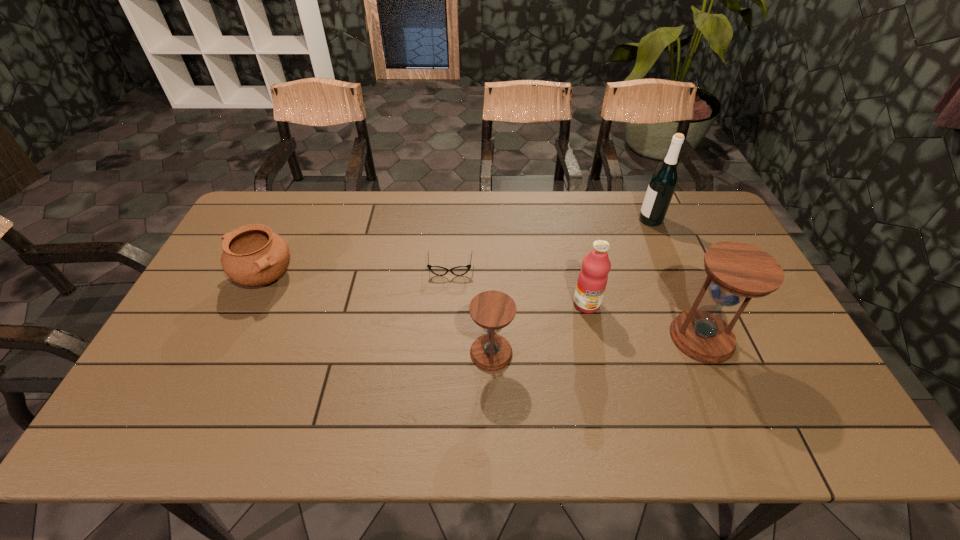
Where is `free space located 0.400m on the back of the left hourglass`? This screenshot has height=540, width=960. free space located 0.400m on the back of the left hourglass is located at coordinates (489, 238).

Image resolution: width=960 pixels, height=540 pixels. I want to click on free space located 0.050m on the back of the right hourglass, so click(685, 300).

You are a GUI agent. You are given a task and a screenshot of the screen. Output one action in this format:
    pyautogui.click(x=<x>, y=<y>)
    Task: Click on the free space located 0.080m on the label of the wine bottle
    The height and width of the screenshot is (540, 960).
    Given the screenshot: What is the action you would take?
    pyautogui.click(x=615, y=220)

Find the location of a particular element. Image resolution: width=960 pixels, height=540 pixels. free space located on the label of the wine bottle is located at coordinates (540, 220).

Locate an element on the screen. blank space located on the label of the wine bottle is located at coordinates (523, 220).

You are a GUI agent. You are given a task and a screenshot of the screen. Output one action in this format:
    pyautogui.click(x=<x>, y=<y>)
    Task: Click on the blank space located on the front-facing side of the spectacles
    The width and height of the screenshot is (960, 540).
    Given the screenshot: What is the action you would take?
    pyautogui.click(x=447, y=308)

Where is `free space located 0.200m on the front of the leftmost object`? This screenshot has height=540, width=960. free space located 0.200m on the front of the leftmost object is located at coordinates (227, 359).

This screenshot has width=960, height=540. What are the coordinates of `free space located on the label of the third tallest object` in the screenshot? It's located at (594, 341).

Locate an element on the screen. This screenshot has width=960, height=540. object that is at the far edge is located at coordinates (663, 182).

The image size is (960, 540). I want to click on object located at the near edge, so [492, 310].